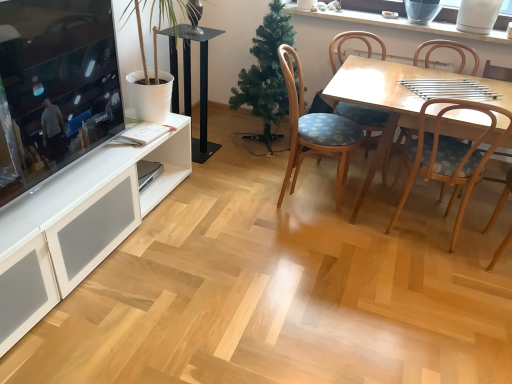
This screenshot has height=384, width=512. In order to click on free space between black glass speaker at center and blue fabric chair at center, which appears as the 4th chair when viewed from the right in this screenshot , I will do `click(238, 172)`.